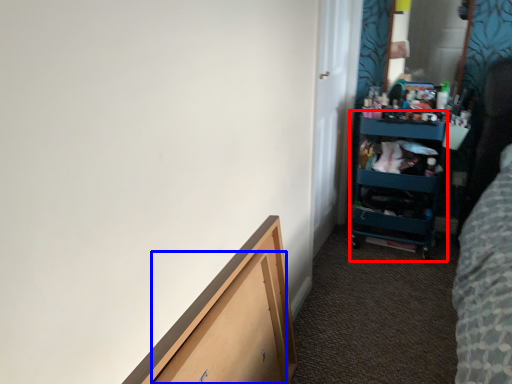
Question: Which object appears closest to the camera in this image, cabinet (highlighted by a red box) or drawer (highlighted by a blue box)?

Choices:
 (A) cabinet
 (B) drawer

Answer: (B)